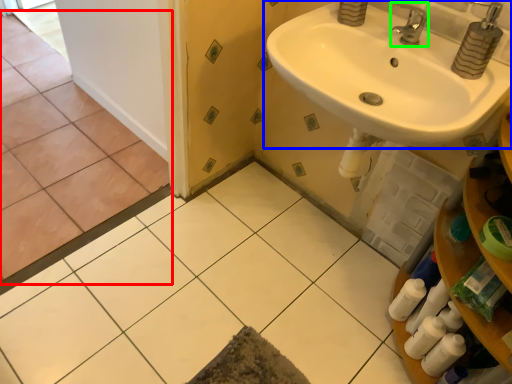
Question: Based on their relative distances, which object is nearer to ceramic tile (highlighted by a red box)? Choose from sink (highlighted by a blue box) and tap (highlighted by a green box).

Choices:
 (A) sink
 (B) tap

Answer: (A)